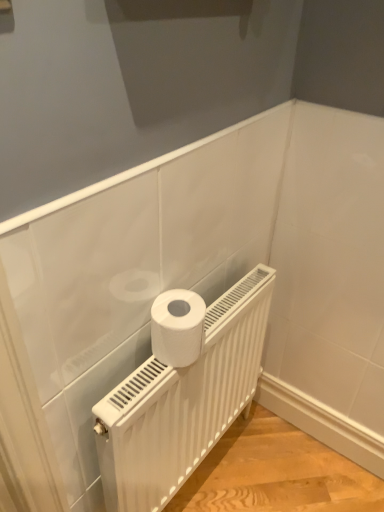
The height and width of the screenshot is (512, 384). In order to click on white matte toilet paper at center in this screenshot , I will do `click(177, 327)`.

The image size is (384, 512). Describe the element at coordinates (177, 327) in the screenshot. I see `white matte toilet paper at center` at that location.

The width and height of the screenshot is (384, 512). Describe the element at coordinates (182, 391) in the screenshot. I see `white matte radiator at center` at that location.

This screenshot has height=512, width=384. I want to click on white matte radiator at center, so click(x=182, y=391).

What is the approximate height of white matte radiator at center?

28.81 inches.

At what (x,y) coordinates should I click in order to perform the action: click on white matte toilet paper at center. Please return your answer as a coordinate pair (x, y). The width and height of the screenshot is (384, 512). Looking at the image, I should click on (177, 327).

Is white matte toilet paper at center to the right of white matte radiator at center from the viewer's perspective?

In fact, white matte toilet paper at center is to the left of white matte radiator at center.

From the picture: Considering the positions of objects white matte toilet paper at center and white matte radiator at center in the image provided, who is in front, white matte toilet paper at center or white matte radiator at center?

white matte radiator at center is more forward.

Does point (157, 300) appear closer or farther from the camera than point (127, 506)?

Point (157, 300).

From the image's perspective, is white matte toilet paper at center above or below white matte radiator at center?

white matte toilet paper at center is situated higher than white matte radiator at center in the image.

From a real-world perspective, between white matte toilet paper at center and white matte radiator at center, who is vertically lower?

In real-world perspective, white matte radiator at center is lower.

Is white matte toilet paper at center wider than white matte radiator at center?

Indeed, white matte toilet paper at center has a greater width compared to white matte radiator at center.

Considering the sizes of white matte toilet paper at center and white matte radiator at center in the image, is white matte toilet paper at center taller or shorter than white matte radiator at center?

Considering their sizes, white matte toilet paper at center has less height than white matte radiator at center.

Is white matte toilet paper at center bigger than white matte radiator at center?

No, white matte toilet paper at center is not bigger than white matte radiator at center.

Would you say white matte toilet paper at center is inside or outside white matte radiator at center?

white matte toilet paper at center is not inside white matte radiator at center, it's outside.

Is white matte toilet paper at center not near white matte radiator at center?

That's not correct — white matte toilet paper at center is a little close to white matte radiator at center.

Is white matte toilet paper at center positioned with its back to white matte radiator at center?

No, white matte toilet paper at center is not facing the opposite direction of white matte radiator at center.

In order to click on toilet paper located above the white matte radiator at center (from a real-world perspective) in this screenshot , I will do `click(177, 327)`.

Can you confirm if white matte radiator at center is positioned to the right of white matte toilet paper at center?

Yes, white matte radiator at center is to the right of white matte toilet paper at center.

Is the depth of white matte radiator at center greater than that of white matte toilet paper at center?

That is False.

Looking at this image, which point is more forward, (233, 309) or (185, 321)?

The point (185, 321) is in front.

From the image's perspective, is white matte radiator at center above white matte toilet paper at center?

No, from the image's perspective, white matte radiator at center is not above white matte toilet paper at center.

From a real-world perspective, between white matte radiator at center and white matte toilet paper at center, who is vertically lower?

In real-world perspective, white matte radiator at center is lower.

Does white matte radiator at center have a greater width compared to white matte toilet paper at center?

No, white matte radiator at center is not wider than white matte toilet paper at center.

Considering the sizes of white matte radiator at center and white matte toilet paper at center in the image, is white matte radiator at center taller or shorter than white matte toilet paper at center?

white matte radiator at center is taller than white matte toilet paper at center.

Between white matte radiator at center and white matte toilet paper at center, which one has smaller size?

Smaller between the two is white matte toilet paper at center.

Is white matte radiator at center not within white matte toilet paper at center?

That's correct, white matte radiator at center is outside of white matte toilet paper at center.

Can you see white matte radiator at center touching white matte toilet paper at center?

No, white matte radiator at center is not next to white matte toilet paper at center.

Is white matte radiator at center aimed at white matte toilet paper at center?

No, white matte radiator at center is not turned towards white matte toilet paper at center.

Can you tell me how much white matte radiator at center and white matte toilet paper at center differ in facing direction?

0.00107 degrees.

Measure the distance between white matte radiator at center and white matte toilet paper at center.

white matte radiator at center is 8.57 inches away from white matte toilet paper at center.

Find the location of a particular element. The image size is (384, 512). radiator located below the white matte toilet paper at center (from the image's perspective) is located at coordinates (182, 391).

Locate an element on the screen. The image size is (384, 512). toilet paper that appears above the white matte radiator at center (from the image's perspective) is located at coordinates (177, 327).

Locate an element on the screen. This screenshot has height=512, width=384. radiator lying on the right of white matte toilet paper at center is located at coordinates (182, 391).